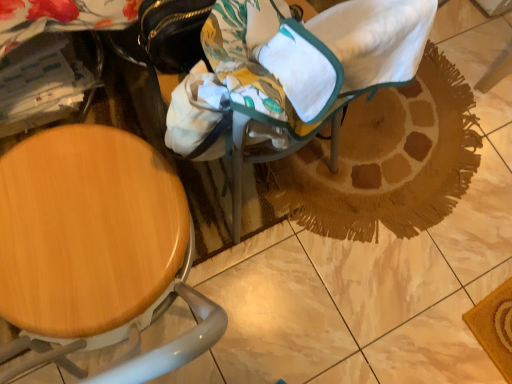
Identify the location of free location in front of canvas fabric baby carriage at center. (262, 296).